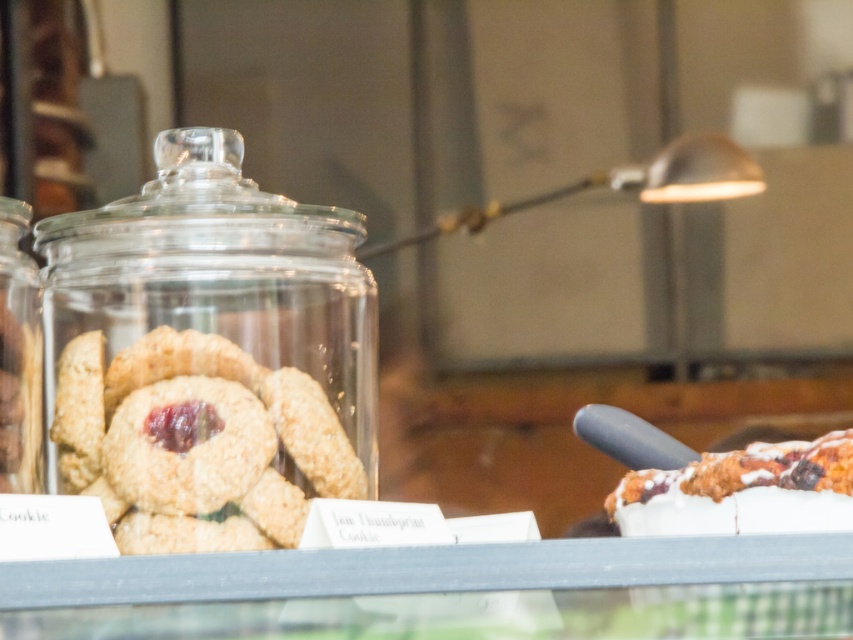
Does transparent glass jar at left lie in front of glazed sugar cookie at right?

No, it is behind glazed sugar cookie at right.

Does point (73, 467) lie in front of point (796, 492)?

That is False.

Does point (241, 150) come in front of point (779, 516)?

That is False.

Identify the location of transparent glass jar at left. (209, 353).